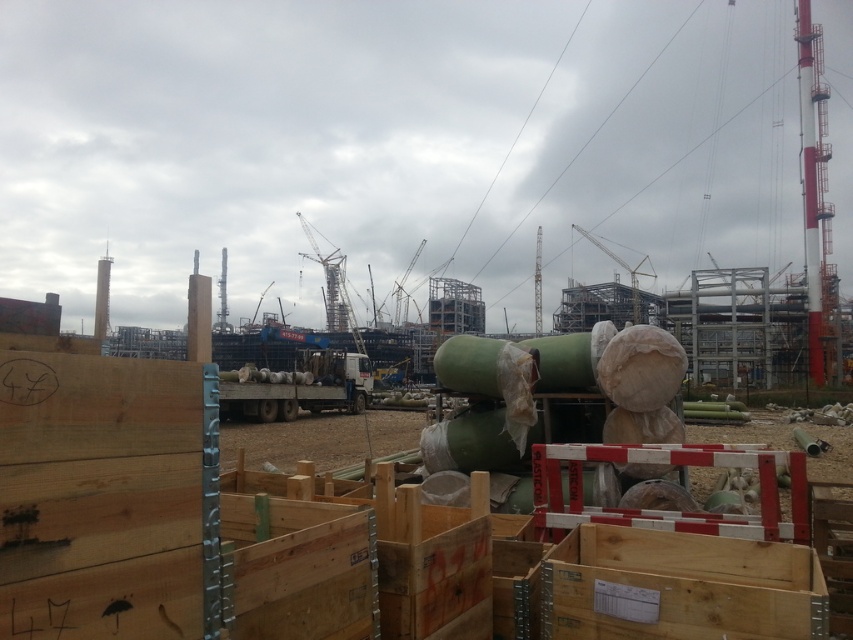
You are a delivery driver who needs to park your white matte trailer truck at center in a parking lot that has a 60 feet width. Can you park your truck there?

The white matte trailer truck at center is 61.42 feet in length, which exceeds the parking lot width of 60 feet. Therefore, it cannot be parked there.

You are a delivery driver who needs to park your white matte trailer truck at center in a specific spot marked at coordinates 0.606, 0.351. Can you confirm if the truck is already parked correctly based on the scene description?

The white matte trailer truck at center is located at point (299, 387), so yes, it is parked correctly in the specified spot.

You are a delivery driver who needs to back up your truck to load materials. You see the white matte trailer truck at center and the metallic gray crane at center. What is the minimum distance you need to maintain between your truck and the crane to ensure safety?

The minimum distance you need to maintain between the white matte trailer truck at center and the metallic gray crane at center is 36.49 meters to ensure safety.